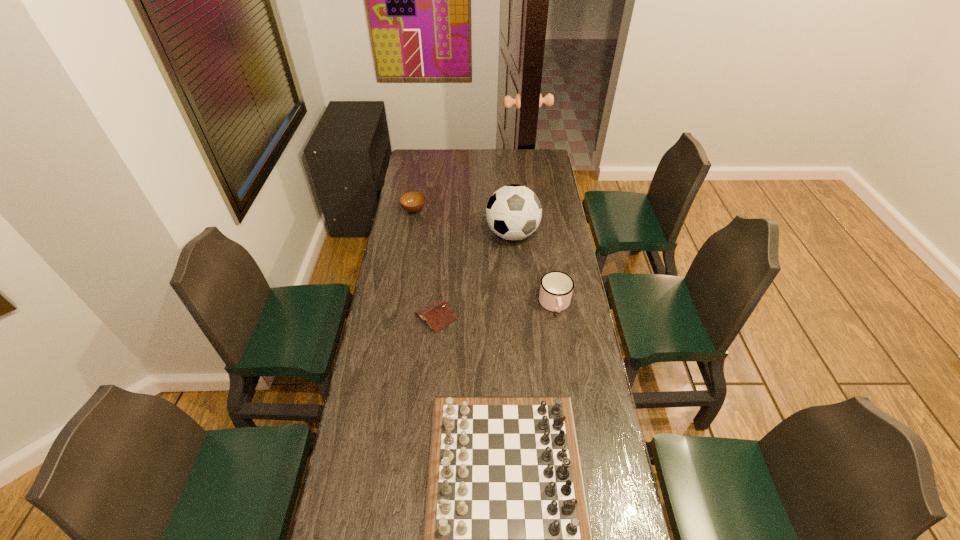
Identify the location of book situated at the left edge. (438, 314).

The image size is (960, 540). Identify the location of soccer ball at the right edge. tap(513, 212).

You are a GUI agent. You are given a task and a screenshot of the screen. Output one action in this format:
    pyautogui.click(x=<x>, y=<y>)
    Task: Click on the mug located in the right edge section of the desktop
    
    Given the screenshot: What is the action you would take?
    pyautogui.click(x=556, y=288)

In order to click on blank space at the far edge in this screenshot , I will do `click(486, 168)`.

This screenshot has width=960, height=540. In the image, there is a desktop. What are the coordinates of `free space at the left edge` in the screenshot? It's located at (408, 377).

What are the coordinates of `free spot at the right edge of the desktop` in the screenshot? It's located at (559, 342).

What are the coordinates of `free space between the tallest object and the second shortest object` in the screenshot? It's located at (464, 222).

The image size is (960, 540). Find the location of `unoccupied position between the mug and the bowl`. unoccupied position between the mug and the bowl is located at coordinates (485, 258).

You are a GUI agent. You are given a task and a screenshot of the screen. Output one action in this format:
    pyautogui.click(x=<x>, y=<y>)
    Task: Click on the vacant point located between the mug and the leftmost object
    This screenshot has height=540, width=960.
    Given the screenshot: What is the action you would take?
    pyautogui.click(x=485, y=258)

Locate an element on the screen. free space between the book and the mug is located at coordinates (495, 310).